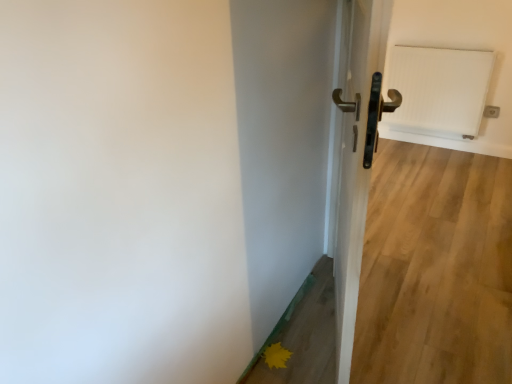
The width and height of the screenshot is (512, 384). Find the location of `vacant area to the right of metallic gold door handle at center`. vacant area to the right of metallic gold door handle at center is located at coordinates (414, 325).